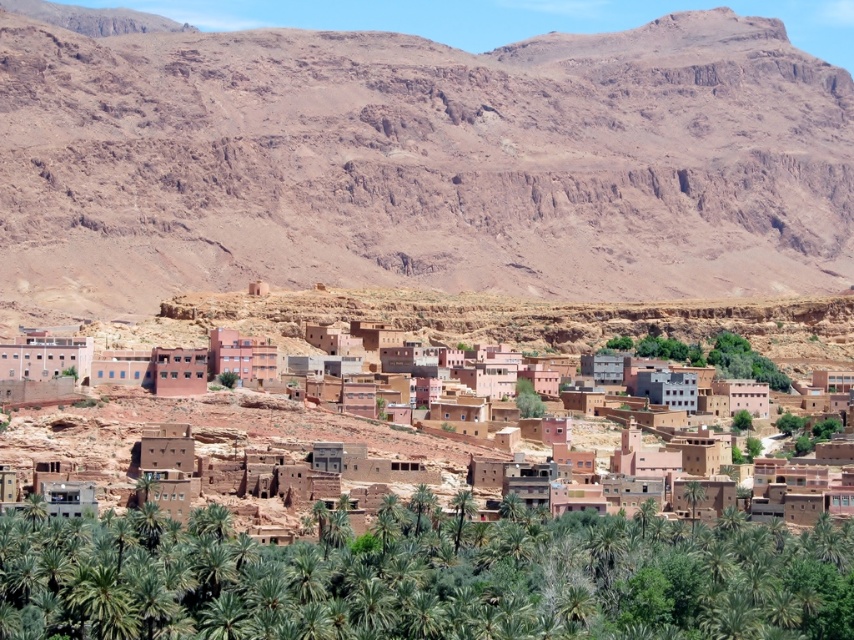
How far apart are green leafy palm trees at lower center and brown mudbrick buildings at center?

28.48 meters

Is point (560, 598) less distant than point (381, 440)?

That is True.

Find the location of `green leafy palm trees at lower center`. green leafy palm trees at lower center is located at coordinates (425, 579).

Does brown rocky mountain at upper center have a greater width compared to green leafy palm trees at lower center?

Indeed, brown rocky mountain at upper center has a greater width compared to green leafy palm trees at lower center.

Which is below, brown rocky mountain at upper center or green leafy palm trees at lower center?

Positioned lower is green leafy palm trees at lower center.

At what (x,y) coordinates should I click in order to perform the action: click on brown rocky mountain at upper center. Please return your answer as a coordinate pair (x, y). Looking at the image, I should click on (420, 163).

Between brown rocky mountain at upper center and brown mudbrick buildings at center, which one appears on the right side from the viewer's perspective?

brown mudbrick buildings at center is more to the right.

Who is more distant from viewer, (606, 272) or (41, 419)?

The point (606, 272) is more distant.

What are the coordinates of `brown rocky mountain at upper center` in the screenshot? It's located at (420, 163).